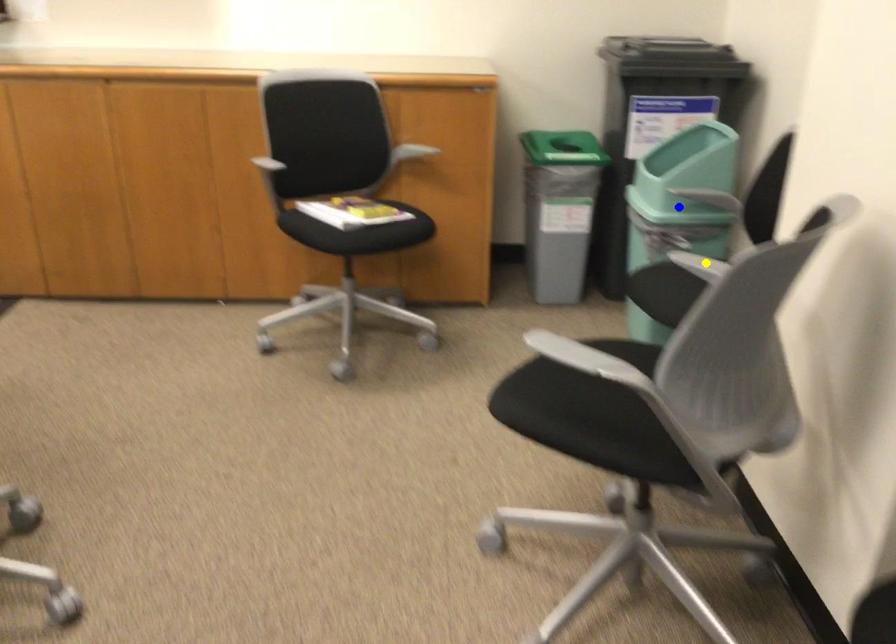
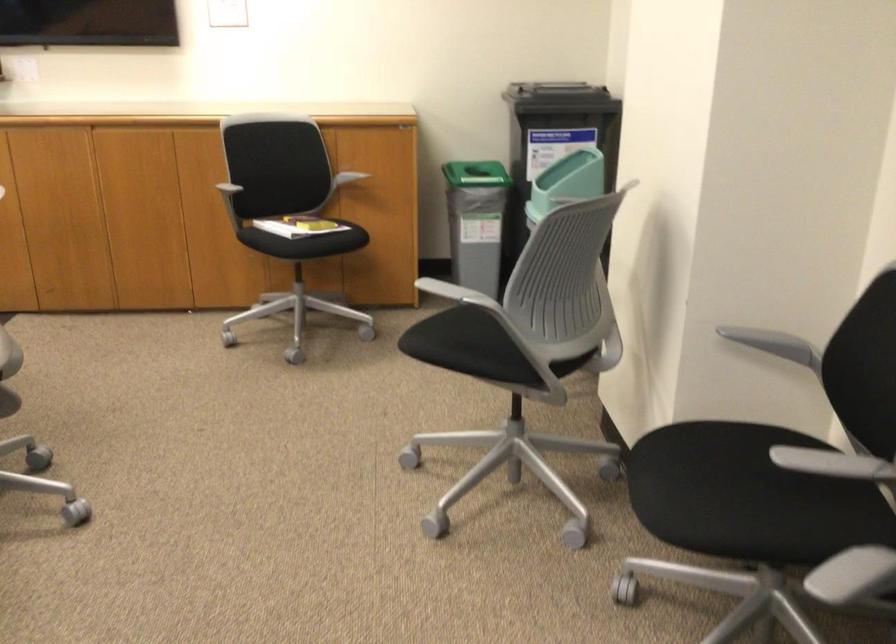
I am providing you with two images of the same scene from different viewpoints. Three points are marked in image1. Which point corresponds to a part or object that is occluded in image2?In image1, three points are marked. Which of them correspond to a part or object that is occluded in image2?Among the three points shown in image1, which one corresponds to a part or object that is no longer visible due to occlusion in image2?

Invisible in image2: green point, yellow point, blue point.